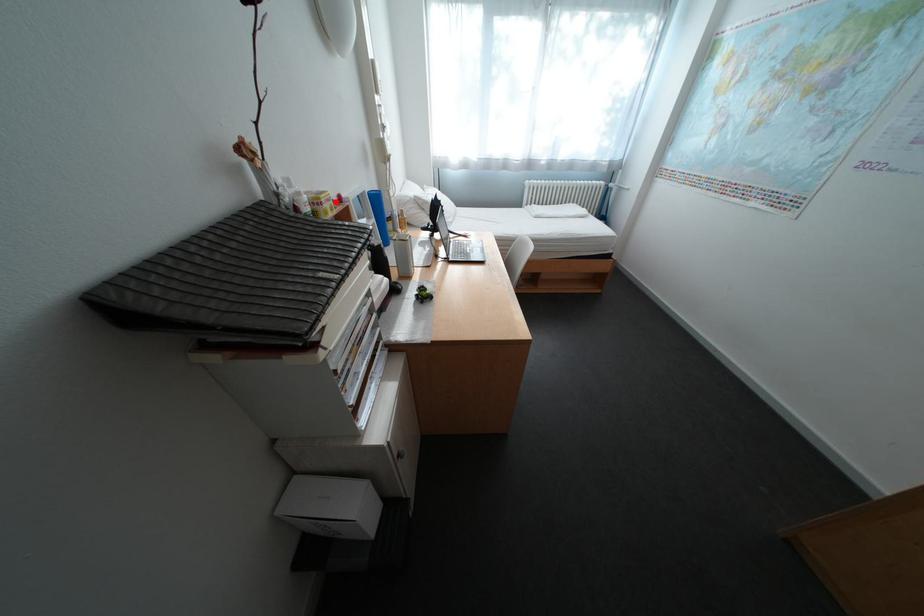
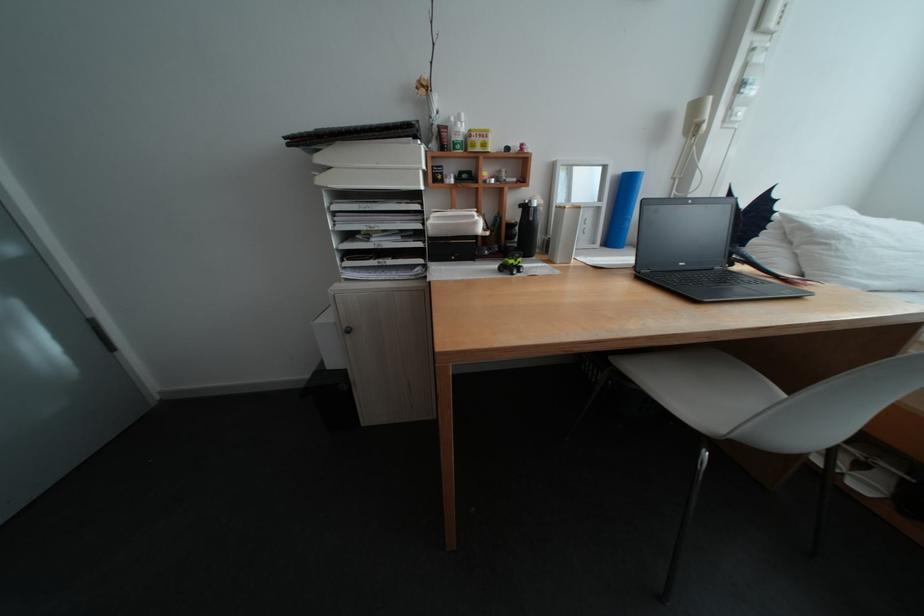
Question: I am providing you with two images of the same scene from different viewpoints. Image1 has a red point marked. In image2, the corresponding 3D location appears at what relative position? Reply with the corresponding letter.

Choices:
 (A) Closer
 (B) Farther

Answer: (B)